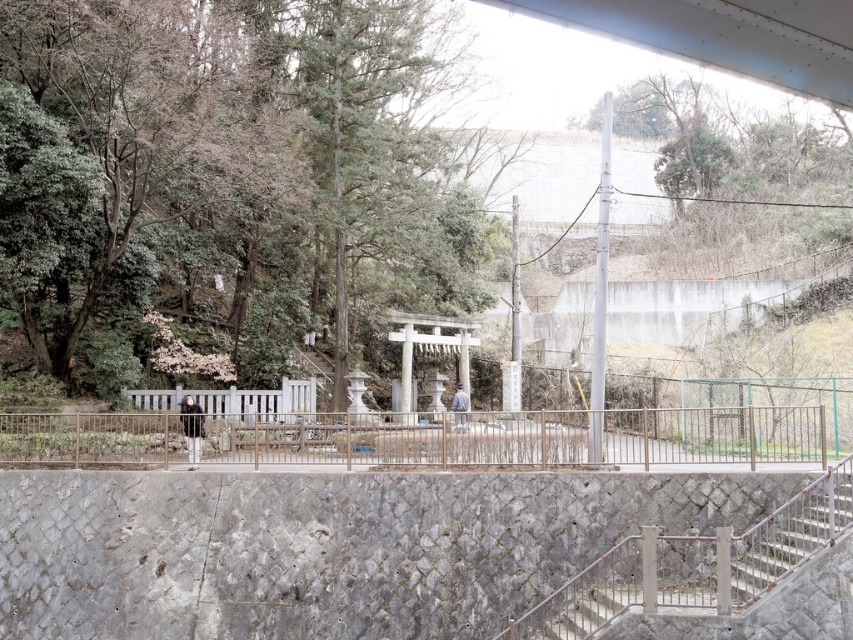
You are standing in a park and see the green leafy tree at center. If you want to take a closer photo of it with your phone, which is 1.5 meters away from you, will you be able to focus clearly on the tree?

The green leafy tree at center is 29.84 meters away from camera. Since your phone is only 1.5 meters away from you, the tree is much farther than the minimum focusing distance of your phone camera, so you won